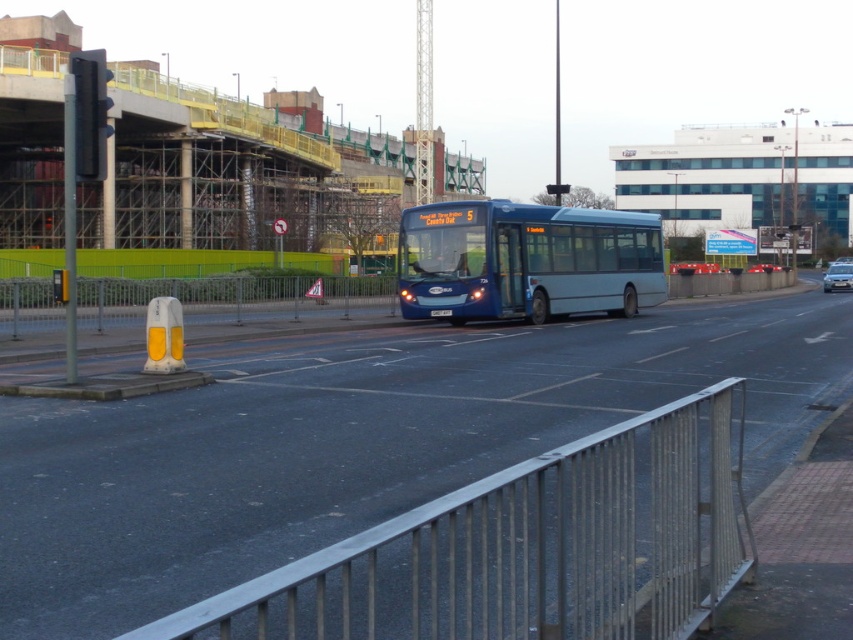
Question: Does silver metallic rail at lower center appear on the right side of silver metallic sedan at right?

Choices:
 (A) yes
 (B) no

Answer: (B)

Question: Which point is closer to the camera?

Choices:
 (A) (320, 598)
 (B) (830, 272)
 (C) (585, 236)

Answer: (A)

Question: Among these objects, which one is farthest from the camera?

Choices:
 (A) matte blue bus at center
 (B) silver metallic sedan at right

Answer: (B)

Question: Does silver metallic rail at lower center appear under matte blue bus at center?

Choices:
 (A) no
 (B) yes

Answer: (B)

Question: Can you confirm if silver metallic rail at lower center is wider than silver metallic sedan at right?

Choices:
 (A) yes
 (B) no

Answer: (B)

Question: Which point is farther from the camera taking this photo?

Choices:
 (A) (389, 589)
 (B) (459, 273)

Answer: (B)